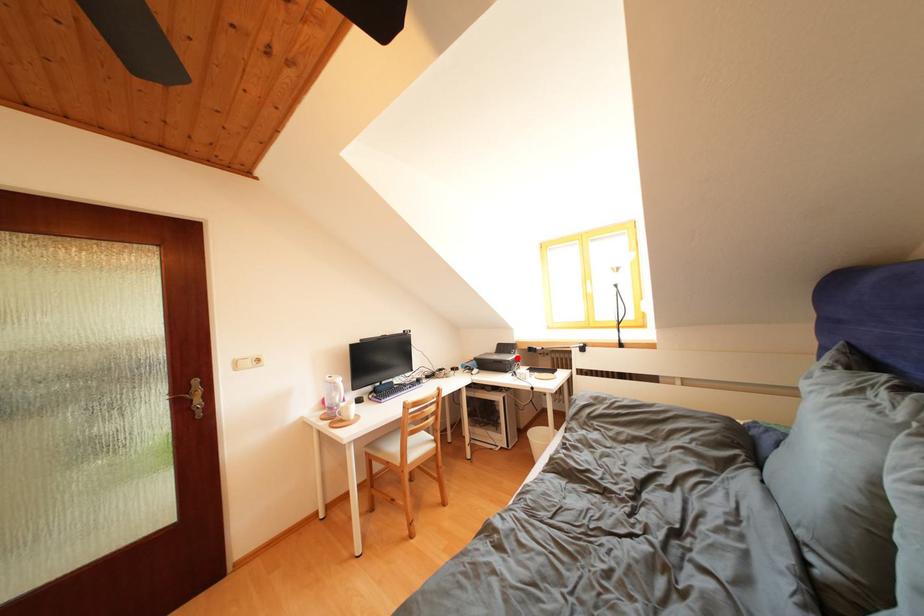
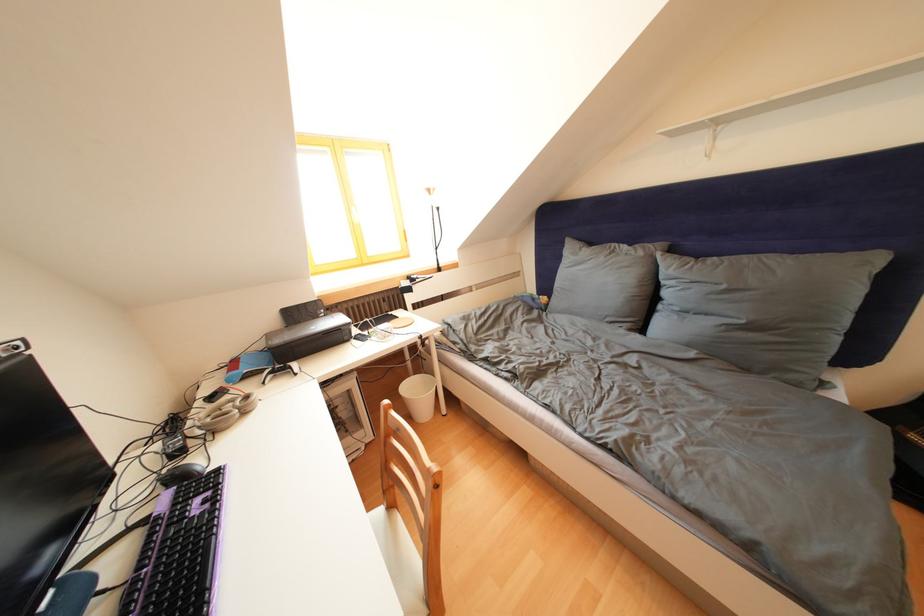
Locate, in the second image, the point that corresponds to the highlighted location in the first image.

(323, 322)